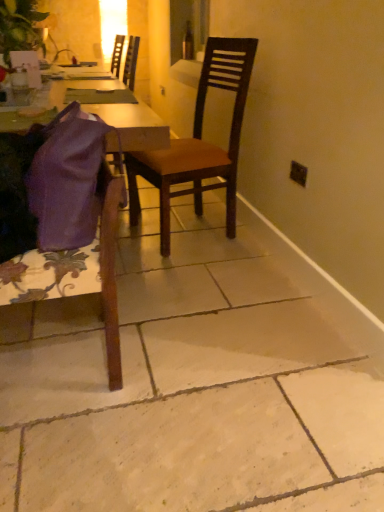
This screenshot has width=384, height=512. What are the coordinates of `free point below brown wooden chair at center, arranged as the second chair when viewed from the front (from a real-world perspective)` in the screenshot? It's located at (190, 231).